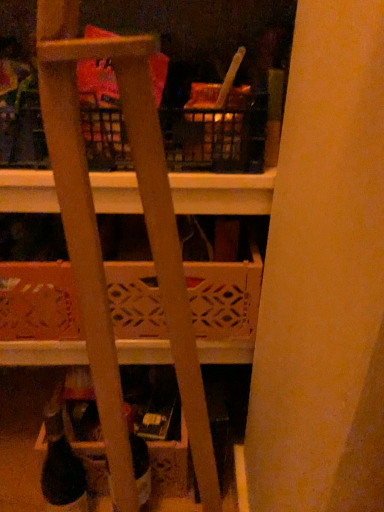
Question: Does matte plastic bottle at lower center have a lesser height compared to black matte wine bottle at lower left?

Choices:
 (A) no
 (B) yes

Answer: (B)

Question: Is matte plastic bottle at lower center not close to black matte wine bottle at lower left?

Choices:
 (A) yes
 (B) no

Answer: (B)

Question: Can you confirm if matte plastic bottle at lower center is positioned to the left of black matte wine bottle at lower left?

Choices:
 (A) no
 (B) yes

Answer: (A)

Question: Is matte plastic bottle at lower center further to camera compared to black matte wine bottle at lower left?

Choices:
 (A) no
 (B) yes

Answer: (A)

Question: Considering the relative sizes of matte plastic bottle at lower center and black matte wine bottle at lower left in the image provided, is matte plastic bottle at lower center smaller than black matte wine bottle at lower left?

Choices:
 (A) no
 (B) yes

Answer: (A)

Question: Considering the positions of matte plastic bottle at lower center and wooden lattice basket at center in the image, is matte plastic bottle at lower center bigger or smaller than wooden lattice basket at center?

Choices:
 (A) big
 (B) small

Answer: (B)

Question: Is matte plastic bottle at lower center taller or shorter than wooden lattice basket at center?

Choices:
 (A) tall
 (B) short

Answer: (A)

Question: Is matte plastic bottle at lower center to the left or to the right of wooden lattice basket at center in the image?

Choices:
 (A) right
 (B) left

Answer: (B)

Question: In the image, is matte plastic bottle at lower center positioned in front of or behind wooden lattice basket at center?

Choices:
 (A) front
 (B) behind

Answer: (A)

Question: From the image's perspective, relative to wooden lattice basket at center, is black matte wine bottle at lower left above or below?

Choices:
 (A) below
 (B) above

Answer: (A)

Question: Do you think black matte wine bottle at lower left is within wooden lattice basket at center, or outside of it?

Choices:
 (A) inside
 (B) outside

Answer: (B)

Question: Looking at their shapes, would you say black matte wine bottle at lower left is wider or thinner than wooden lattice basket at center?

Choices:
 (A) wide
 (B) thin

Answer: (B)

Question: Relative to wooden lattice basket at center, is black matte wine bottle at lower left in front or behind?

Choices:
 (A) behind
 (B) front

Answer: (B)

Question: Considering their positions, is matte plastic bottle at lower center located in front of or behind black matte wine bottle at lower left?

Choices:
 (A) behind
 (B) front

Answer: (B)

Question: Is matte plastic bottle at lower center wider or thinner than black matte wine bottle at lower left?

Choices:
 (A) wide
 (B) thin

Answer: (A)